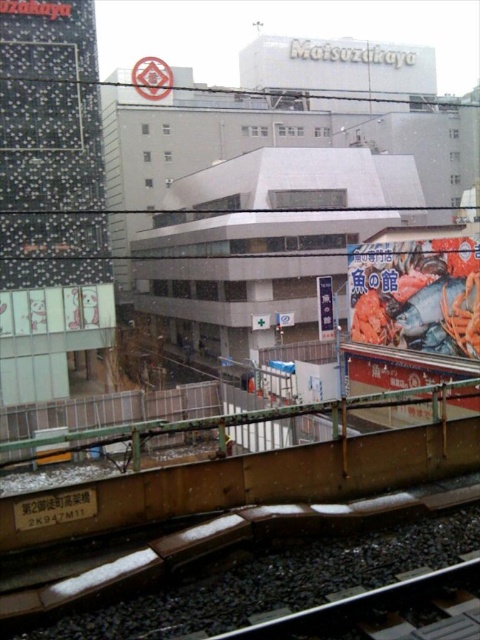
Question: Which of the following is the farthest from the observer?

Choices:
 (A) (407, 324)
 (B) (331, 285)

Answer: (B)

Question: Which point is closer to the camera?

Choices:
 (A) bright orange seafood at right
 (B) white paper sign at center

Answer: (A)

Question: Is bright orange seafood at right above white paper sign at center?

Choices:
 (A) no
 (B) yes

Answer: (A)

Question: Observing the image, what is the correct spatial positioning of bright orange seafood at right in reference to white paper sign at center?

Choices:
 (A) below
 (B) above

Answer: (A)

Question: Is bright orange seafood at right smaller than white paper sign at center?

Choices:
 (A) no
 (B) yes

Answer: (A)